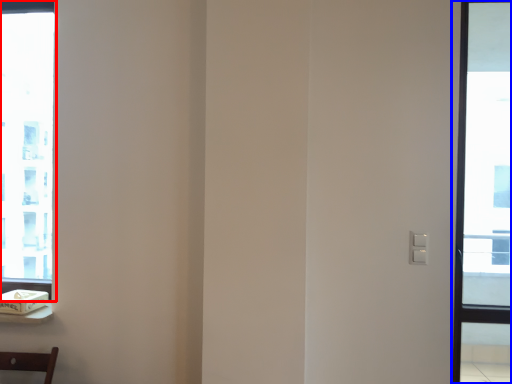
Question: Among these objects, which one is farthest to the camera, window (highlighted by a red box) or window (highlighted by a blue box)?

Choices:
 (A) window
 (B) window

Answer: (A)